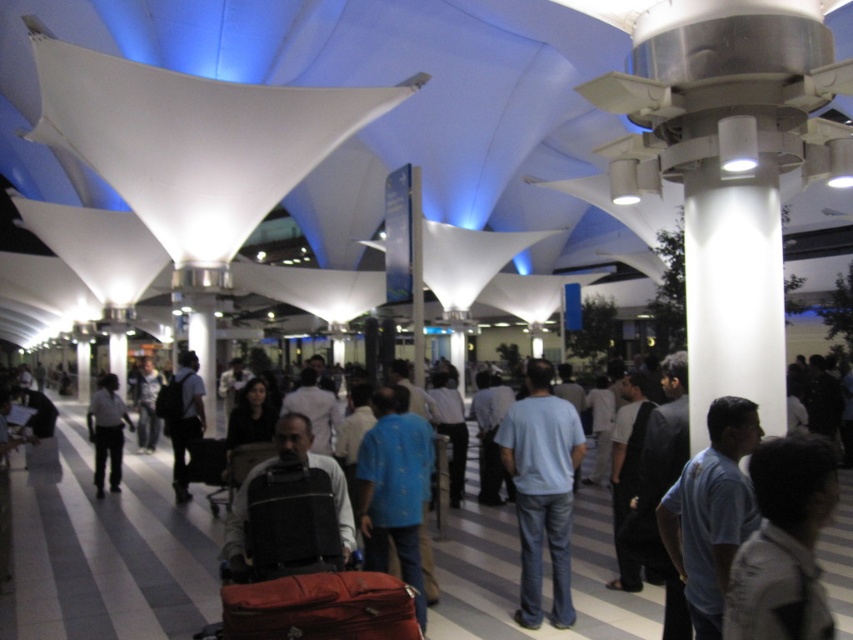
You are a traveler in this modern transportation hub with a light blue cotton shirt at center and a light blue shirt at center. Which one of these shirts is smaller in size?

The light blue cotton shirt at center is smaller in size compared to the light blue shirt at center.

You are a traveler in this modern transportation hub with two light blue shirts visible. You need to pack a lightweight shirt for your trip. Which one should you choose between the light blue cotton shirt at center and the light blue shirt at center?

The light blue cotton shirt at center is thinner, making it a better choice for a lightweight option.